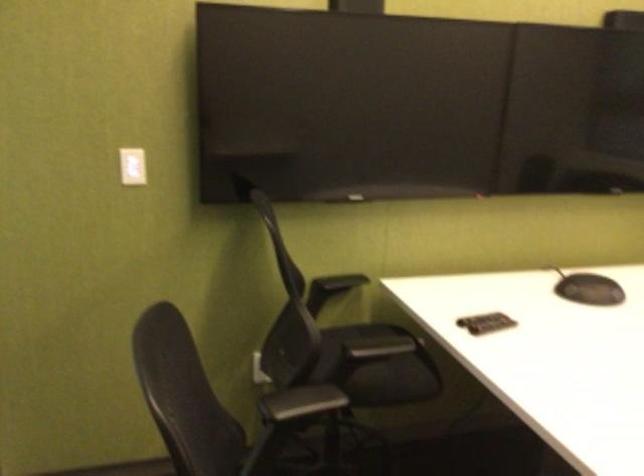
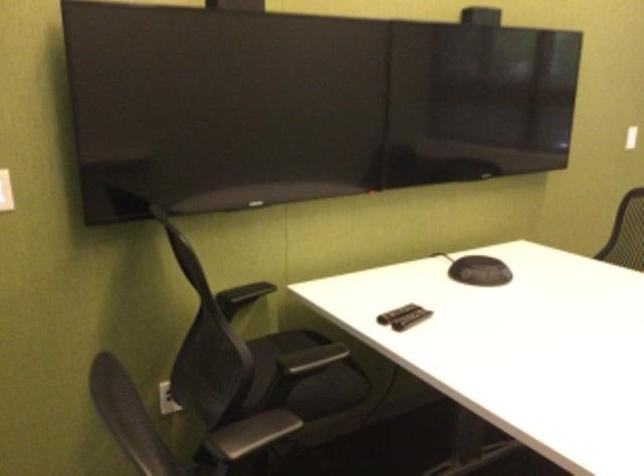
Question: The images are taken continuously from a first-person perspective. In which direction is your viewpoint rotating?

Choices:
 (A) Left
 (B) Right
 (C) Up
 (D) Down

Answer: (B)